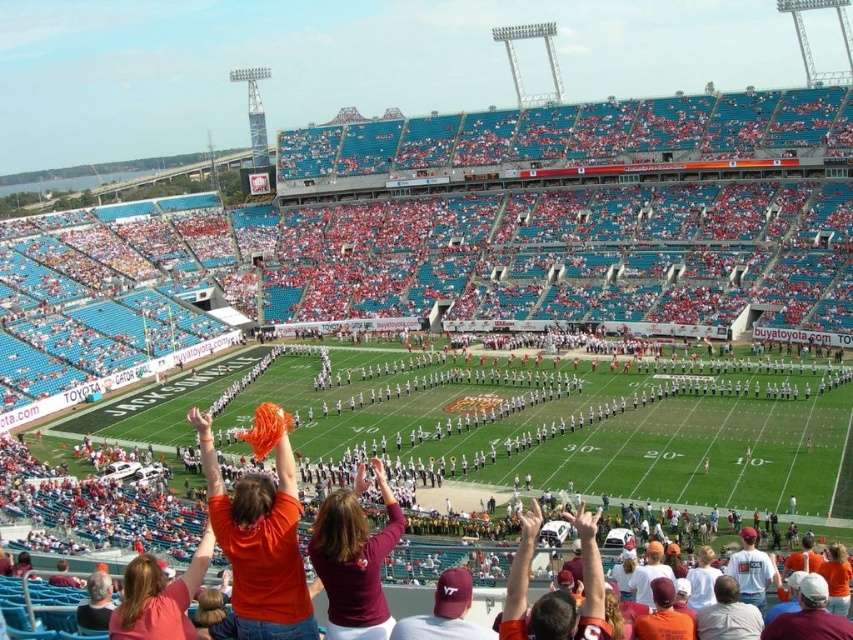
Is orange fabric at center below maroon jersey at center?

Incorrect, orange fabric at center is not positioned below maroon jersey at center.

Does orange fabric at center come behind maroon jersey at center?

Yes.

Between point (289, 461) and point (312, 557), which one is positioned behind?

Point (289, 461)

Identify the location of orange fabric at center. The image size is (853, 640). (259, 540).